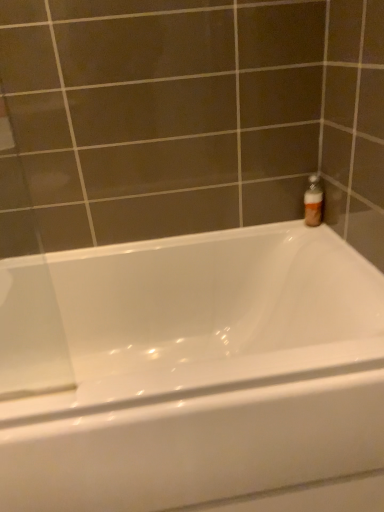
Question: Is point (56, 309) positioned closer to the camera than point (319, 199)?

Choices:
 (A) closer
 (B) farther

Answer: (B)

Question: From the image's perspective, is white glossy bathtub at upper right positioned above or below translucent plastic bottle at upper right?

Choices:
 (A) below
 (B) above

Answer: (A)

Question: Visually, is white glossy bathtub at upper right positioned to the left or to the right of translucent plastic bottle at upper right?

Choices:
 (A) left
 (B) right

Answer: (A)

Question: From the image's perspective, is translucent plastic bottle at upper right located above or below white glossy bathtub at upper right?

Choices:
 (A) above
 (B) below

Answer: (A)

Question: From a real-world perspective, relative to white glossy bathtub at upper right, is translucent plastic bottle at upper right vertically above or below?

Choices:
 (A) below
 (B) above

Answer: (B)

Question: Is translucent plastic bottle at upper right inside or outside of white glossy bathtub at upper right?

Choices:
 (A) outside
 (B) inside

Answer: (A)

Question: Looking at their shapes, would you say translucent plastic bottle at upper right is wider or thinner than white glossy bathtub at upper right?

Choices:
 (A) thin
 (B) wide

Answer: (A)